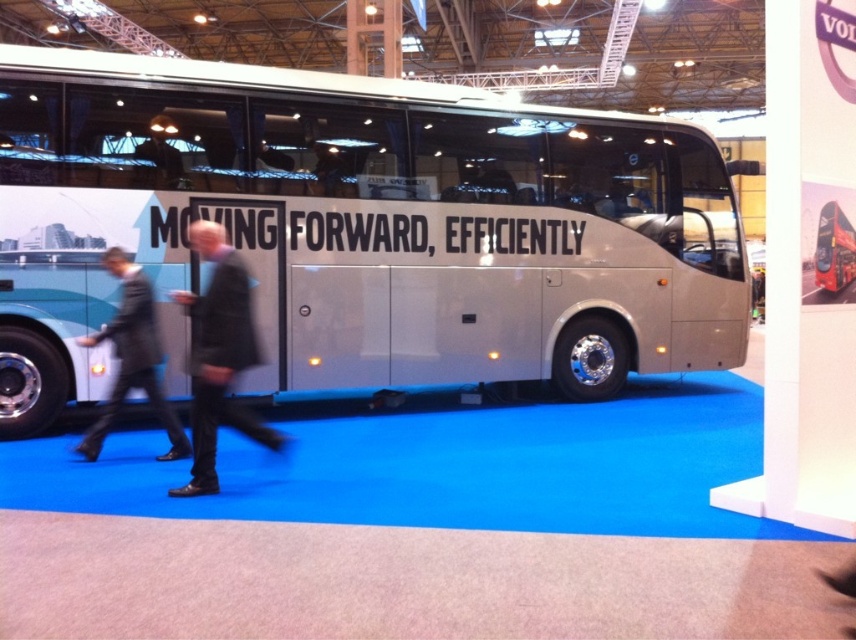
Does point (420, 305) come closer to viewer compared to point (201, 484)?

No, (420, 305) is behind (201, 484).

Does white metallic bus at center appear on the left side of dark gray suit at center?

Incorrect, white metallic bus at center is not on the left side of dark gray suit at center.

Is point (203, 209) positioned behind point (188, 296)?

Yes, it is.

Locate an element on the screen. white metallic bus at center is located at coordinates (360, 227).

Does white metallic bus at center have a greater width compared to dark gray suit at left?

Yes, white metallic bus at center is wider than dark gray suit at left.

What do you see at coordinates (360, 227) in the screenshot?
I see `white metallic bus at center` at bounding box center [360, 227].

This screenshot has height=640, width=856. Identify the location of white metallic bus at center. (360, 227).

Does dark gray suit at center have a larger size compared to dark gray suit at left?

Actually, dark gray suit at center might be smaller than dark gray suit at left.

Looking at this image, can you confirm if dark gray suit at center is smaller than dark gray suit at left?

Indeed, dark gray suit at center has a smaller size compared to dark gray suit at left.

Is point (215, 445) farther from camera compared to point (140, 353)?

No, (215, 445) is in front of (140, 353).

The image size is (856, 640). I want to click on dark gray suit at center, so click(220, 355).